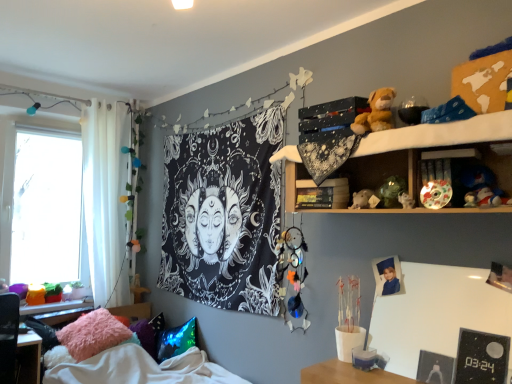
Measure the distance between porcelain plate at upper right and camera.

The distance of porcelain plate at upper right from camera is 5.27 feet.

The width and height of the screenshot is (512, 384). Describe the element at coordinates (439, 134) in the screenshot. I see `wooden shelf at upper right` at that location.

Image resolution: width=512 pixels, height=384 pixels. What do you see at coordinates (122, 358) in the screenshot? I see `fuzzy pink pillow at lower left` at bounding box center [122, 358].

Image resolution: width=512 pixels, height=384 pixels. What do you see at coordinates (364, 199) in the screenshot? I see `matte white teddy bear at center-right, placed as the 5th toy when sorted from right to left` at bounding box center [364, 199].

What is the approximate height of matte white teddy bear at center-right, the 3th toy from the bottom?

matte white teddy bear at center-right, the 3th toy from the bottom, is 3.84 inches tall.

Describe the element at coordinates (176, 340) in the screenshot. I see `shiny blue pillow at lower left, acting as the third pillow starting from the left` at that location.

What is the approximate width of shiny blue pillow at lower left, acting as the 1th pillow starting from the right?

36.00 centimeters.

Find the location of a particular element. porcelain plate at upper right is located at coordinates (465, 176).

Considering the relative positions of fuzzy pink pillow at lower left and white sheer curtain at left in the image provided, is fuzzy pink pillow at lower left to the left of white sheer curtain at left from the viewer's perspective?

No, fuzzy pink pillow at lower left is not to the left of white sheer curtain at left.

What's the angular difference between fuzzy pink pillow at lower left and white sheer curtain at left's facing directions?

They differ by 0.38 degrees in their facing directions.

From a real-world perspective, which object rests below the other?

In real-world perspective, fuzzy pink pillow at lower left is lower.

Is fuzzy pink pillow at lower left looking in the opposite direction of white sheer curtain at left?

No, fuzzy pink pillow at lower left is not facing away from white sheer curtain at left.

Considering the relative sizes of fuzzy pink pillow at lower left and brown plush toy at upper right, arranged as the 1th toy when viewed from the top, in the image provided, is fuzzy pink pillow at lower left bigger than brown plush toy at upper right, arranged as the 1th toy when viewed from the top,?

Yes, fuzzy pink pillow at lower left is bigger than brown plush toy at upper right, arranged as the 1th toy when viewed from the top.

From the image's perspective, is fuzzy pink pillow at lower left beneath brown plush toy at upper right, arranged as the 1th toy when viewed from the top?

Yes.

Would you say fuzzy pink pillow at lower left is a long distance from brown plush toy at upper right, the 4th toy viewed from the right?

Yes, fuzzy pink pillow at lower left is far from brown plush toy at upper right, the 4th toy viewed from the right.

Can you confirm if fuzzy pink pillow at lower left is wider than brown plush toy at upper right, the 3th toy from the left?

Correct, the width of fuzzy pink pillow at lower left exceeds that of brown plush toy at upper right, the 3th toy from the left.

Looking at their sizes, would you say black fabric tapestry at center is wider or thinner than brown plush toy at upper right, arranged as the 1th toy when viewed from the top?

black fabric tapestry at center is thinner than brown plush toy at upper right, arranged as the 1th toy when viewed from the top.

Is point (258, 128) more distant than point (377, 93)?

That is True.

Is the position of black fabric tapestry at center more distant than that of brown plush toy at upper right, the 4th toy viewed from the right?

Yes, it is.

How many degrees apart are the facing directions of black fabric tapestry at center and brown plush toy at upper right, the 4th toy viewed from the right?

There is a 0.89-degree angle between the facing directions of black fabric tapestry at center and brown plush toy at upper right, the 4th toy viewed from the right.

Consider the image. From a real-world perspective, is fuzzy pink pillow at lower left beneath white glossy figurine at upper right, which ranks as the fifth toy in top-to-bottom order?

Yes, from a real-world perspective, fuzzy pink pillow at lower left is below white glossy figurine at upper right, which ranks as the fifth toy in top-to-bottom order.

Is the surface of fuzzy pink pillow at lower left in direct contact with white glossy figurine at upper right, which ranks as the fifth toy in top-to-bottom order?

There is a gap between fuzzy pink pillow at lower left and white glossy figurine at upper right, which ranks as the fifth toy in top-to-bottom order.

What are the coordinates of `toy that is the 3rd one when counting backward from the fuzzy pink pillow at lower left` in the screenshot? It's located at (406, 200).

Choose the correct answer: Is fuzzy pink pillow at lower left inside white glossy figurine at upper right, the third toy viewed from the right, or outside it?

fuzzy pink pillow at lower left is spatially situated outside white glossy figurine at upper right, the third toy viewed from the right.

What's the angular difference between multicolored dreamcatcher at center, the 6th toy when ordered from top to bottom, and matte white teddy bear at center-right, the 3th toy from the bottom,'s facing directions?

3.59 degrees separate the facing orientations of multicolored dreamcatcher at center, the 6th toy when ordered from top to bottom, and matte white teddy bear at center-right, the 3th toy from the bottom.

Is point (298, 312) positioned in front of point (373, 194)?

No, (298, 312) is further to viewer.

Where is `toy that is the 1st one when counting rightward from the multicolored dreamcatcher at center, the first toy in the left-to-right sequence`? toy that is the 1st one when counting rightward from the multicolored dreamcatcher at center, the first toy in the left-to-right sequence is located at coordinates (364, 199).

Who is bigger, multicolored dreamcatcher at center, which appears as the 1th toy when ordered from the bottom, or matte white teddy bear at center-right, placed as the 5th toy when sorted from right to left?

Bigger between the two is multicolored dreamcatcher at center, which appears as the 1th toy when ordered from the bottom.

Visually, is white glossy figurine at upper right, the third toy viewed from the right, positioned to the left or to the right of wooden shelf at upper right?

From the image, it's evident that white glossy figurine at upper right, the third toy viewed from the right, is to the right of wooden shelf at upper right.

Is white glossy figurine at upper right, placed as the 2th toy when sorted from bottom to top, turned away from wooden shelf at upper right?

Absolutely, white glossy figurine at upper right, placed as the 2th toy when sorted from bottom to top, is directed away from wooden shelf at upper right.

Locate an element on the screen. the 4th toy directly beneath the wooden shelf at upper right (from a real-world perspective) is located at coordinates (406, 200).

Is white glossy figurine at upper right, placed as the 2th toy when sorted from bottom to top, wider or thinner than wooden shelf at upper right?

In the image, white glossy figurine at upper right, placed as the 2th toy when sorted from bottom to top, appears to be more narrow than wooden shelf at upper right.

Considering the sizes of objects matte white teddy bear at center-right, the 3th toy from the bottom, and fluffy pink pillow at lower left, which is counted as the 3th pillow, starting from the right, in the image provided, who is wider, matte white teddy bear at center-right, the 3th toy from the bottom, or fluffy pink pillow at lower left, which is counted as the 3th pillow, starting from the right,?

With larger width is fluffy pink pillow at lower left, which is counted as the 3th pillow, starting from the right.

There is a matte white teddy bear at center-right, which is the 4th toy in top-to-bottom order. Where is `the 1st pillow below it (from a real-world perspective)`? the 1st pillow below it (from a real-world perspective) is located at coordinates (93, 334).

How distant is matte white teddy bear at center-right, the 3th toy from the bottom, from fluffy pink pillow at lower left, which is counted as the 1th pillow, starting from the left?

matte white teddy bear at center-right, the 3th toy from the bottom, and fluffy pink pillow at lower left, which is counted as the 1th pillow, starting from the left, are 6.60 feet apart from each other.

Is matte white teddy bear at center-right, placed as the 5th toy when sorted from right to left, next to fluffy pink pillow at lower left, which is counted as the 1th pillow, starting from the left, and touching it?

No.

Find the location of `curtain located above the fuzzy pink pillow at lower left (from a real-world perspective)`. curtain located above the fuzzy pink pillow at lower left (from a real-world perspective) is located at coordinates (102, 194).

From the fuzzy pink pillow at lower left, count 3rd toy to the right and point to it. Please provide its 2D coordinates.

[(376, 112)]

Estimate the real-world distances between objects in this image. Which object is further from shiny blue pillow at lower left, acting as the third pillow starting from the left, white sheer curtain at left or white glossy figurine at upper right, which is the fourth toy from left to right?

white glossy figurine at upper right, which is the fourth toy from left to right, is positioned further to the anchor shiny blue pillow at lower left, acting as the third pillow starting from the left.

Looking at the image, which one is located further to porcelain plate at upper right, shiny multicolored ball at upper right, marked as the 2th toy in a right-to-left arrangement, or wooden shelf at upper right?

wooden shelf at upper right is further to porcelain plate at upper right.

When comparing their distances from shiny blue pillow at lower left, acting as the 1th pillow starting from the right, does black fabric tapestry at center or fluffy pink pillow at lower left, which is counted as the 1th pillow, starting from the left, seem further?

Among the two, black fabric tapestry at center is located further to shiny blue pillow at lower left, acting as the 1th pillow starting from the right.

When comparing their distances from matte white teddy bear at center-right, the 3th toy from the bottom, does fuzzy pink pillow at lower left or white sheer curtain at left seem further?

white sheer curtain at left is positioned further to the anchor matte white teddy bear at center-right, the 3th toy from the bottom.

From the image, which object appears to be farther from porcelain plate at upper right, black fabric tapestry at center or shiny blue pillow at lower left, acting as the 1th pillow starting from the right?

shiny blue pillow at lower left, acting as the 1th pillow starting from the right, is further to porcelain plate at upper right.

Considering their positions, is matte white teddy bear at center-right, the 3th toy from the bottom, positioned further to fuzzy pink pillow at lower left than black fabric tapestry at center?

matte white teddy bear at center-right, the 3th toy from the bottom, is further to fuzzy pink pillow at lower left.

From the image, which object appears to be nearer to shiny blue pillow at lower left, acting as the third pillow starting from the left, wooden shelf at upper right or brown plush toy at upper right, the 3th toy from the left?

wooden shelf at upper right is closer to shiny blue pillow at lower left, acting as the third pillow starting from the left.

Looking at the image, which one is located further to multicolored dreamcatcher at center, which appears as the 1th toy when ordered from the bottom, fluffy pink pillow at lower left, which is counted as the 1th pillow, starting from the left, or shiny blue pillow at lower left, acting as the third pillow starting from the left?

fluffy pink pillow at lower left, which is counted as the 1th pillow, starting from the left.

I want to click on shelf that lies between brown plush toy at upper right, the 4th toy viewed from the right, and multicolored dreamcatcher at center, the 6th toy when ordered from top to bottom, from top to bottom, so click(439, 134).

The width and height of the screenshot is (512, 384). What are the coordinates of `curtain between white sheer curtain at left and blue plush toy at upper right, acting as the 2th toy starting from the top, in the horizontal direction` in the screenshot? It's located at (102, 194).

At what (x,y) coordinates should I click in order to perform the action: click on shelf situated between fluffy pink pillow at lower left, which is counted as the 1th pillow, starting from the left, and shiny multicolored ball at upper right, which is the 4th toy from bottom to top, from left to right. Please return your answer as a coordinate pair (x, y). Looking at the image, I should click on (439, 134).

Identify the location of pillow between fuzzy pink pillow at lower left and blue plush toy at upper right, acting as the 2th toy starting from the top. The image size is (512, 384). (176, 340).